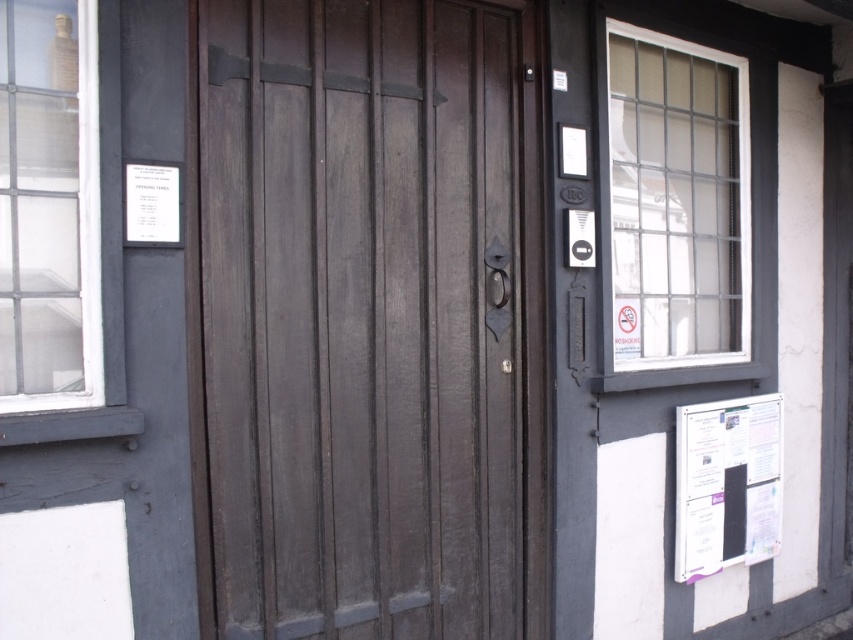
Question: Which object appears closest to the camera in this image?

Choices:
 (A) white paperboard at lower right
 (B) dark wood door at center
 (C) clear glass window at upper left
 (D) clear glass window at upper right

Answer: (C)

Question: Is clear glass window at upper right thinner than white paperboard at lower right?

Choices:
 (A) no
 (B) yes

Answer: (A)

Question: Among these objects, which one is nearest to the camera?

Choices:
 (A) white paperboard at lower right
 (B) clear glass window at upper right

Answer: (B)

Question: Which point appears closest to the camera in this image?

Choices:
 (A) (361, 632)
 (B) (677, 541)
 (C) (654, 358)
 (D) (120, 422)

Answer: (D)

Question: Considering the relative positions of clear glass window at upper right and white paperboard at lower right in the image provided, where is clear glass window at upper right located with respect to white paperboard at lower right?

Choices:
 (A) right
 (B) left

Answer: (B)

Question: Is dark wood door at center behind clear glass window at upper right?

Choices:
 (A) no
 (B) yes

Answer: (A)